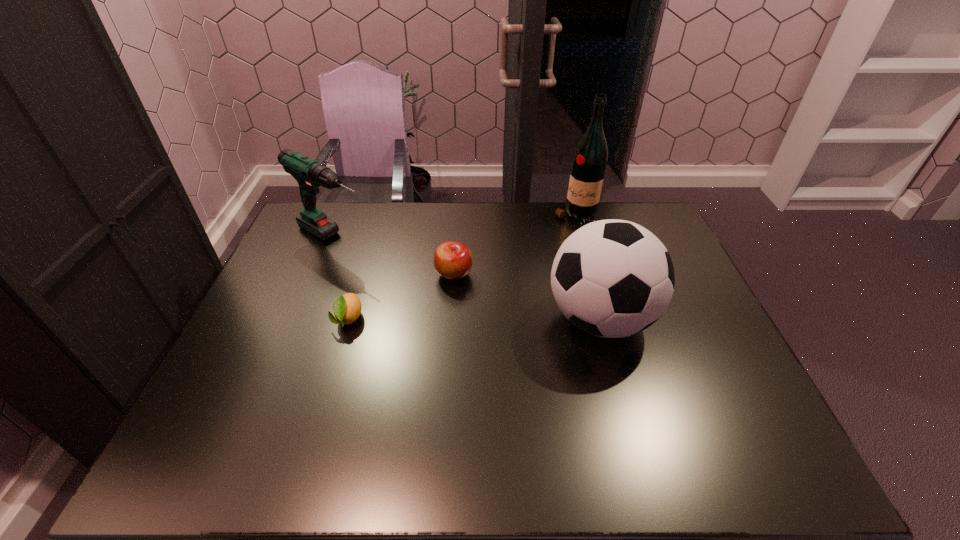
The image size is (960, 540). Find the location of `free space on the desktop that is between the lemon and the soccer ball and is positioned on the surface of the tallest object`. free space on the desktop that is between the lemon and the soccer ball and is positioned on the surface of the tallest object is located at coordinates (484, 319).

The image size is (960, 540). Find the location of `vacant space on the desktop that is between the shortest object and the soccer ball and is positioned on the stem of the second shortest object`. vacant space on the desktop that is between the shortest object and the soccer ball and is positioned on the stem of the second shortest object is located at coordinates (492, 319).

You are a GUI agent. You are given a task and a screenshot of the screen. Output one action in this format:
    pyautogui.click(x=<x>, y=<y>)
    Task: Click on the free space on the desktop that is between the lemon and the soccer ball and is positioned on the handle side of the drill
    
    Given the screenshot: What is the action you would take?
    pyautogui.click(x=470, y=319)